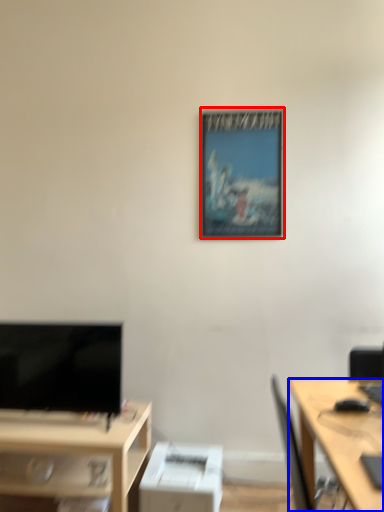
Question: Which object appears closest to the camera in this image, picture frame (highlighted by a red box) or desk (highlighted by a blue box)?

Choices:
 (A) picture frame
 (B) desk

Answer: (B)